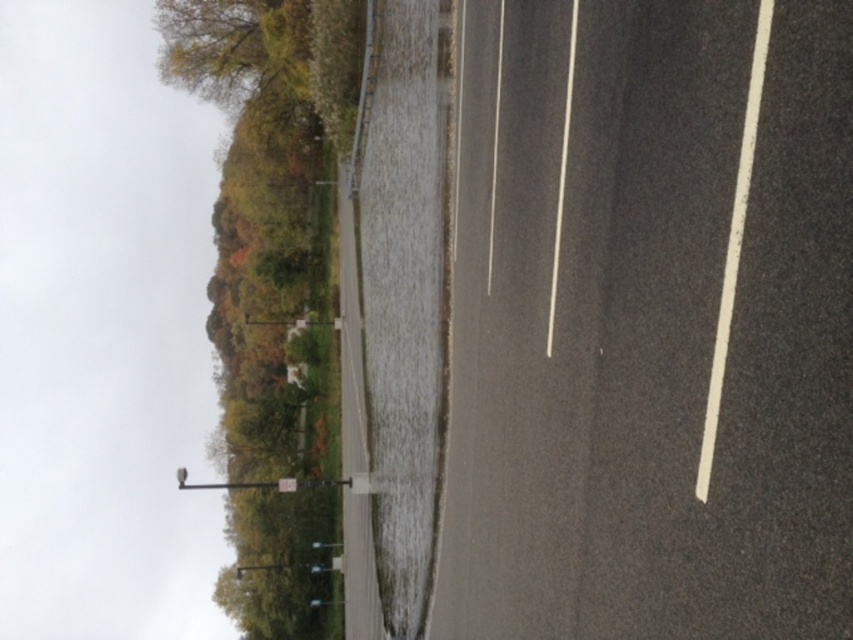
You are a delivery driver navigating a route and need to confirm your current location. You see a black asphalt highway at center. According to the map, your current position should be at point (650, 323). Is the highway at this coordinate?

Yes, the black asphalt highway at center is located at point (650, 323), so the highway is at this coordinate.

You are a driver approaching the black asphalt highway at center and notice the green leafy tree at upper left in your rearview mirror. Which object will appear smaller in your mirror as you drive forward?

The black asphalt highway at center will appear smaller in the mirror than the green leafy tree at upper left because it has a smaller size compared to the tree.

You are driving a car and see the black asphalt highway at center and the green leafy tree at upper left in your view. Which object is closer to you as you look ahead?

The black asphalt highway at center is closer to you because it is in front of the green leafy tree at upper left, meaning the tree is further away in the background.